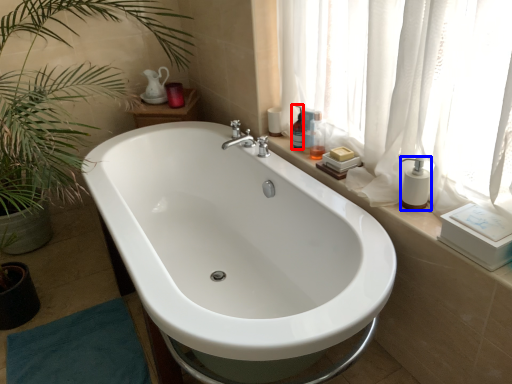
Question: Which of the following is the closest to the observer, toiletry (highlighted by a red box) or soap dispenser (highlighted by a blue box)?

Choices:
 (A) toiletry
 (B) soap dispenser

Answer: (B)